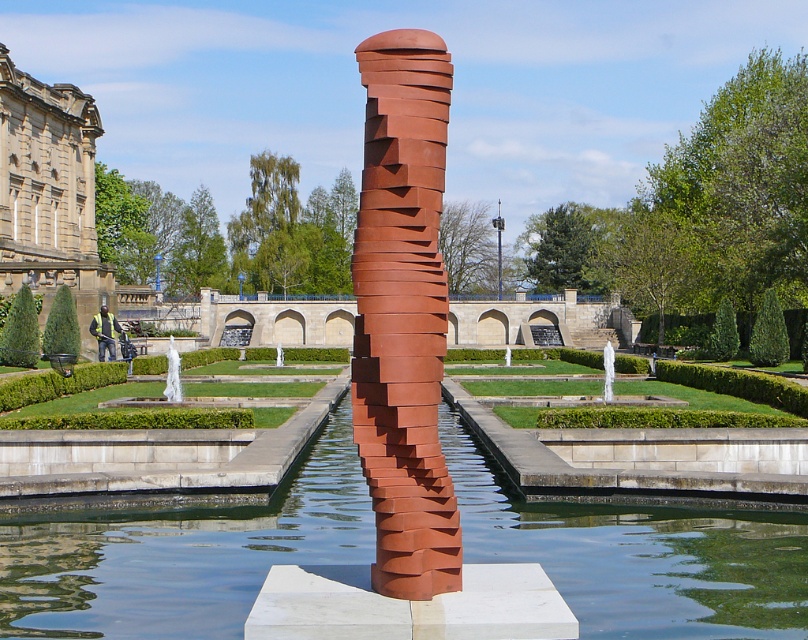
Does green grass at center come behind white glossy statue at center?

No.

Does green grass at center have a greater width compared to white glossy statue at center?

Correct, the width of green grass at center exceeds that of white glossy statue at center.

Image resolution: width=808 pixels, height=640 pixels. I want to click on green grass at center, so click(735, 385).

Locate an element on the screen. The width and height of the screenshot is (808, 640). green grass at center is located at coordinates pos(735,385).

Is point (424, 246) positioned before point (66, 385)?

Yes.

Which of these two, rusty metal column at center or green grass at center, stands taller?

rusty metal column at center

Measure the distance between rusty metal column at center and camera.

They are 24.74 feet apart.

Where is `rusty metal column at center`? The image size is (808, 640). rusty metal column at center is located at coordinates (404, 314).

The height and width of the screenshot is (640, 808). I want to click on green grass at center, so click(735, 385).

Which of these two, green grass at center or white marble fountain at center, stands shorter?

green grass at center

Is point (485, 356) behind point (177, 385)?

Yes, it is.

What are the coordinates of `green grass at center` in the screenshot? It's located at (735, 385).